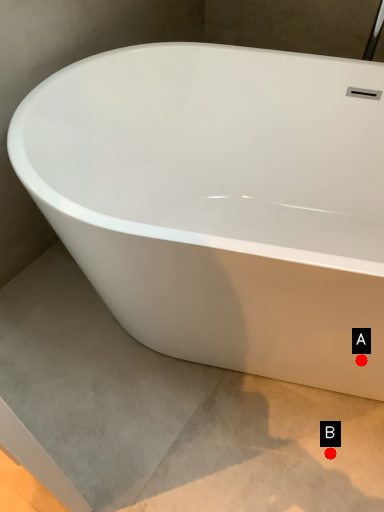
Question: Two points are circled on the image, labeled by A and B beside each circle. Which point is closer to the camera?

Choices:
 (A) A is closer
 (B) B is closer

Answer: (A)